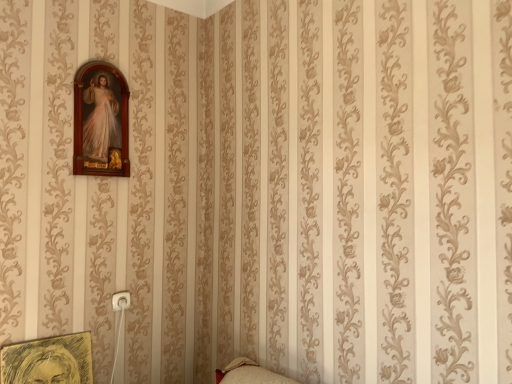
Where is `wooden picture frame at upper left, which is counted as the 2th picture frame, starting from the bottom`? wooden picture frame at upper left, which is counted as the 2th picture frame, starting from the bottom is located at coordinates (100, 121).

What do you see at coordinates (100, 121) in the screenshot? This screenshot has height=384, width=512. I see `wooden picture frame at upper left, which is the first picture frame in top-to-bottom order` at bounding box center [100, 121].

At what (x,y) coordinates should I click in order to perform the action: click on yellow sketchbook at lower left, marked as the first picture frame in a bottom-to-top arrangement. Please return your answer as a coordinate pair (x, y). The height and width of the screenshot is (384, 512). Looking at the image, I should click on (48, 360).

What do you see at coordinates (48, 360) in the screenshot? I see `yellow sketchbook at lower left, marked as the first picture frame in a bottom-to-top arrangement` at bounding box center [48, 360].

This screenshot has width=512, height=384. I want to click on wooden picture frame at upper left, which is the first picture frame in top-to-bottom order, so click(x=100, y=121).

Based on the photo, is yellow sketchbook at lower left, marked as the first picture frame in a bottom-to-top arrangement, at the left side of wooden picture frame at upper left, which is counted as the 2th picture frame, starting from the bottom?

Yes, yellow sketchbook at lower left, marked as the first picture frame in a bottom-to-top arrangement, is to the left of wooden picture frame at upper left, which is counted as the 2th picture frame, starting from the bottom.

Considering the relative positions of yellow sketchbook at lower left, marked as the first picture frame in a bottom-to-top arrangement, and wooden picture frame at upper left, which is counted as the 2th picture frame, starting from the bottom, in the image provided, is yellow sketchbook at lower left, marked as the first picture frame in a bottom-to-top arrangement, behind wooden picture frame at upper left, which is counted as the 2th picture frame, starting from the bottom,?

No, it is in front of wooden picture frame at upper left, which is counted as the 2th picture frame, starting from the bottom.

Considering the positions of points (34, 345) and (111, 156), is point (34, 345) farther from camera compared to point (111, 156)?

That is False.

From the image's perspective, is yellow sketchbook at lower left, marked as the first picture frame in a bottom-to-top arrangement, below wooden picture frame at upper left, which is the first picture frame in top-to-bottom order?

Yes, from the image's perspective, yellow sketchbook at lower left, marked as the first picture frame in a bottom-to-top arrangement, is beneath wooden picture frame at upper left, which is the first picture frame in top-to-bottom order.

From a real-world perspective, between yellow sketchbook at lower left, marked as the first picture frame in a bottom-to-top arrangement, and wooden picture frame at upper left, which is counted as the 2th picture frame, starting from the bottom, who is vertically higher?

wooden picture frame at upper left, which is counted as the 2th picture frame, starting from the bottom, is physically above.

In terms of width, does yellow sketchbook at lower left, which is the second picture frame from top to bottom, look wider or thinner when compared to wooden picture frame at upper left, which is counted as the 2th picture frame, starting from the bottom?

Clearly, yellow sketchbook at lower left, which is the second picture frame from top to bottom, has more width compared to wooden picture frame at upper left, which is counted as the 2th picture frame, starting from the bottom.

Who is taller, yellow sketchbook at lower left, marked as the first picture frame in a bottom-to-top arrangement, or wooden picture frame at upper left, which is counted as the 2th picture frame, starting from the bottom?

wooden picture frame at upper left, which is counted as the 2th picture frame, starting from the bottom, is taller.

Considering the sizes of yellow sketchbook at lower left, marked as the first picture frame in a bottom-to-top arrangement, and wooden picture frame at upper left, which is counted as the 2th picture frame, starting from the bottom, in the image, is yellow sketchbook at lower left, marked as the first picture frame in a bottom-to-top arrangement, bigger or smaller than wooden picture frame at upper left, which is counted as the 2th picture frame, starting from the bottom,?

In the image, yellow sketchbook at lower left, marked as the first picture frame in a bottom-to-top arrangement, appears to be smaller than wooden picture frame at upper left, which is counted as the 2th picture frame, starting from the bottom.

Is wooden picture frame at upper left, which is counted as the 2th picture frame, starting from the bottom, completely or partially inside yellow sketchbook at lower left, which is the second picture frame from top to bottom?

No, yellow sketchbook at lower left, which is the second picture frame from top to bottom, does not contain wooden picture frame at upper left, which is counted as the 2th picture frame, starting from the bottom.

Are yellow sketchbook at lower left, marked as the first picture frame in a bottom-to-top arrangement, and wooden picture frame at upper left, which is counted as the 2th picture frame, starting from the bottom, making contact?

Answer: No, yellow sketchbook at lower left, marked as the first picture frame in a bottom-to-top arrangement, is not making contact with wooden picture frame at upper left, which is counted as the 2th picture frame, starting from the bottom.

Is yellow sketchbook at lower left, marked as the first picture frame in a bottom-to-top arrangement, oriented towards wooden picture frame at upper left, which is counted as the 2th picture frame, starting from the bottom?

No, yellow sketchbook at lower left, marked as the first picture frame in a bottom-to-top arrangement, is not facing towards wooden picture frame at upper left, which is counted as the 2th picture frame, starting from the bottom.

What's the angular difference between yellow sketchbook at lower left, which is the second picture frame from top to bottom, and wooden picture frame at upper left, which is the first picture frame in top-to-bottom order,'s facing directions?

2.38 degrees.

How far apart are yellow sketchbook at lower left, marked as the first picture frame in a bottom-to-top arrangement, and wooden picture frame at upper left, which is the first picture frame in top-to-bottom order?

The distance of yellow sketchbook at lower left, marked as the first picture frame in a bottom-to-top arrangement, from wooden picture frame at upper left, which is the first picture frame in top-to-bottom order, is 33.59 inches.

Where is `picture frame in front of the wooden picture frame at upper left, which is the first picture frame in top-to-bottom order`? This screenshot has width=512, height=384. picture frame in front of the wooden picture frame at upper left, which is the first picture frame in top-to-bottom order is located at coordinates (48, 360).

Visually, is wooden picture frame at upper left, which is the first picture frame in top-to-bottom order, positioned to the left or to the right of yellow sketchbook at lower left, marked as the first picture frame in a bottom-to-top arrangement?

Based on their positions, wooden picture frame at upper left, which is the first picture frame in top-to-bottom order, is located to the right of yellow sketchbook at lower left, marked as the first picture frame in a bottom-to-top arrangement.

Which is behind, wooden picture frame at upper left, which is the first picture frame in top-to-bottom order, or yellow sketchbook at lower left, marked as the first picture frame in a bottom-to-top arrangement?

wooden picture frame at upper left, which is the first picture frame in top-to-bottom order, is further from the camera.

Which is closer, (x=114, y=175) or (x=38, y=342)?

The point (x=38, y=342) is in front.

From the image's perspective, between wooden picture frame at upper left, which is counted as the 2th picture frame, starting from the bottom, and yellow sketchbook at lower left, which is the second picture frame from top to bottom, who is located below?

From the image's view, yellow sketchbook at lower left, which is the second picture frame from top to bottom, is below.

From a real-world perspective, is wooden picture frame at upper left, which is the first picture frame in top-to-bottom order, physically located above or below yellow sketchbook at lower left, marked as the first picture frame in a bottom-to-top arrangement?

In terms of real-world spatial position, wooden picture frame at upper left, which is the first picture frame in top-to-bottom order, is above yellow sketchbook at lower left, marked as the first picture frame in a bottom-to-top arrangement.

Which of these two, wooden picture frame at upper left, which is the first picture frame in top-to-bottom order, or yellow sketchbook at lower left, marked as the first picture frame in a bottom-to-top arrangement, is thinner?

With smaller width is wooden picture frame at upper left, which is the first picture frame in top-to-bottom order.

Considering the relative sizes of wooden picture frame at upper left, which is the first picture frame in top-to-bottom order, and yellow sketchbook at lower left, which is the second picture frame from top to bottom, in the image provided, is wooden picture frame at upper left, which is the first picture frame in top-to-bottom order, taller than yellow sketchbook at lower left, which is the second picture frame from top to bottom,?

Yes, wooden picture frame at upper left, which is the first picture frame in top-to-bottom order, is taller than yellow sketchbook at lower left, which is the second picture frame from top to bottom.

Is wooden picture frame at upper left, which is the first picture frame in top-to-bottom order, bigger than yellow sketchbook at lower left, which is the second picture frame from top to bottom?

Indeed, wooden picture frame at upper left, which is the first picture frame in top-to-bottom order, has a larger size compared to yellow sketchbook at lower left, which is the second picture frame from top to bottom.

Is yellow sketchbook at lower left, which is the second picture frame from top to bottom, completely or partially inside wooden picture frame at upper left, which is counted as the 2th picture frame, starting from the bottom?

That's incorrect, yellow sketchbook at lower left, which is the second picture frame from top to bottom, is not inside wooden picture frame at upper left, which is counted as the 2th picture frame, starting from the bottom.

Is wooden picture frame at upper left, which is counted as the 2th picture frame, starting from the bottom, in contact with yellow sketchbook at lower left, marked as the first picture frame in a bottom-to-top arrangement?

No, wooden picture frame at upper left, which is counted as the 2th picture frame, starting from the bottom, is not next to yellow sketchbook at lower left, marked as the first picture frame in a bottom-to-top arrangement.

From the picture: Could you tell me if wooden picture frame at upper left, which is counted as the 2th picture frame, starting from the bottom, is facing yellow sketchbook at lower left, marked as the first picture frame in a bottom-to-top arrangement?

No, wooden picture frame at upper left, which is counted as the 2th picture frame, starting from the bottom, is not aimed at yellow sketchbook at lower left, marked as the first picture frame in a bottom-to-top arrangement.

Can you tell me how much wooden picture frame at upper left, which is the first picture frame in top-to-bottom order, and yellow sketchbook at lower left, marked as the first picture frame in a bottom-to-top arrangement, differ in facing direction?

The angle between the facing direction of wooden picture frame at upper left, which is the first picture frame in top-to-bottom order, and the facing direction of yellow sketchbook at lower left, marked as the first picture frame in a bottom-to-top arrangement, is 2.38 degrees.

How far apart are wooden picture frame at upper left, which is the first picture frame in top-to-bottom order, and yellow sketchbook at lower left, which is the second picture frame from top to bottom?

A distance of 33.59 inches exists between wooden picture frame at upper left, which is the first picture frame in top-to-bottom order, and yellow sketchbook at lower left, which is the second picture frame from top to bottom.

Identify the location of picture frame located above the yellow sketchbook at lower left, which is the second picture frame from top to bottom (from the image's perspective). (100, 121).

Identify the location of picture frame behind the yellow sketchbook at lower left, which is the second picture frame from top to bottom. (100, 121).

At what (x,y) coordinates should I click in order to perform the action: click on picture frame in front of the wooden picture frame at upper left, which is counted as the 2th picture frame, starting from the bottom. Please return your answer as a coordinate pair (x, y). Looking at the image, I should click on (48, 360).